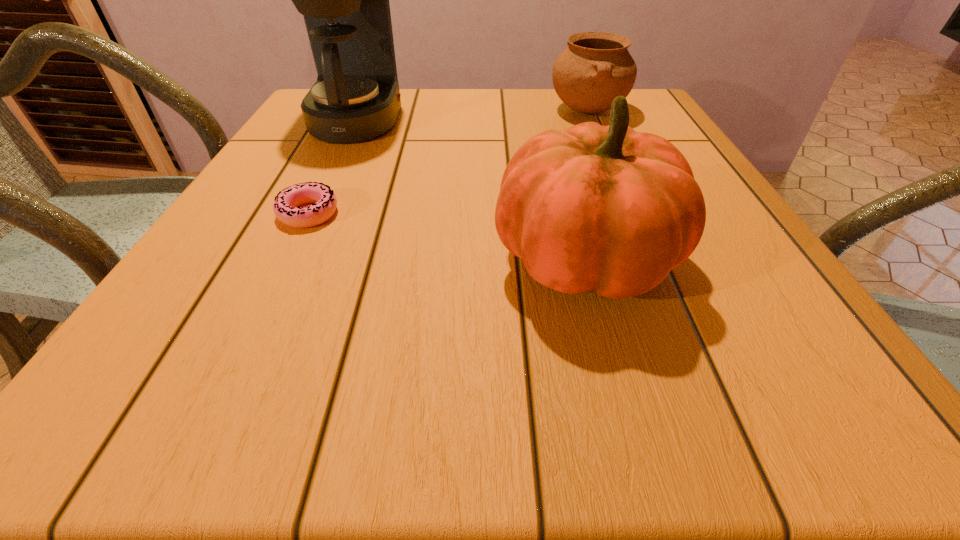
Find the location of a particular element. The height and width of the screenshot is (540, 960). coffee maker is located at coordinates (354, 97).

Locate an element on the screen. The height and width of the screenshot is (540, 960). the second tallest object is located at coordinates (606, 209).

Identify the location of the second shortest object. This screenshot has height=540, width=960. (596, 67).

You are a GUI agent. You are given a task and a screenshot of the screen. Output one action in this format:
    pyautogui.click(x=<x>, y=<y>)
    Task: Click on the doughnut
    
    Given the screenshot: What is the action you would take?
    pyautogui.click(x=286, y=203)

The height and width of the screenshot is (540, 960). I want to click on vacant region located 0.090m on the button side of the coffee maker, so click(437, 120).

Where is `vacant region located 0.100m on the right of the pumpkin`? Image resolution: width=960 pixels, height=540 pixels. vacant region located 0.100m on the right of the pumpkin is located at coordinates (737, 261).

You are a GUI agent. You are given a task and a screenshot of the screen. Output one action in this format:
    pyautogui.click(x=<x>, y=<y>)
    Task: Click on the vacant space situated 0.320m on the front of the pottery
    
    Given the screenshot: What is the action you would take?
    pyautogui.click(x=631, y=209)

Where is `vacant region located 0.340m on the right of the doughnut`? vacant region located 0.340m on the right of the doughnut is located at coordinates (528, 213).

The width and height of the screenshot is (960, 540). Identify the location of coffee maker present at the far edge. (354, 97).

Where is `pottery that is at the far edge`? pottery that is at the far edge is located at coordinates (596, 67).